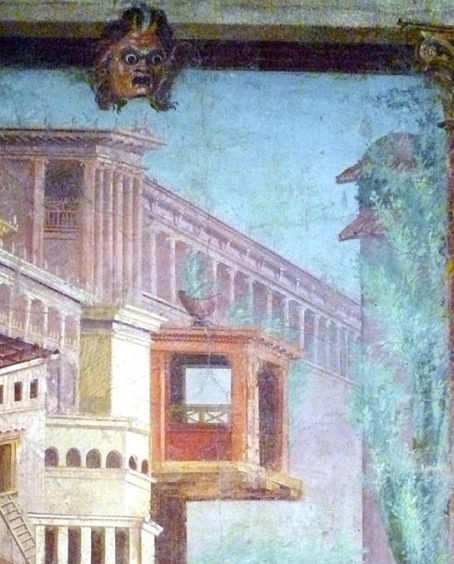
The width and height of the screenshot is (454, 564). In order to click on ladder in this screenshot , I will do `click(15, 524)`, `click(29, 548)`.